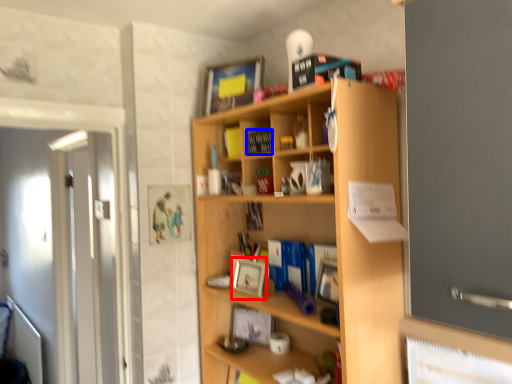
Question: Which point is closer to the camera, picture frame (highlighted by a red box) or book (highlighted by a blue box)?

Choices:
 (A) picture frame
 (B) book

Answer: (A)